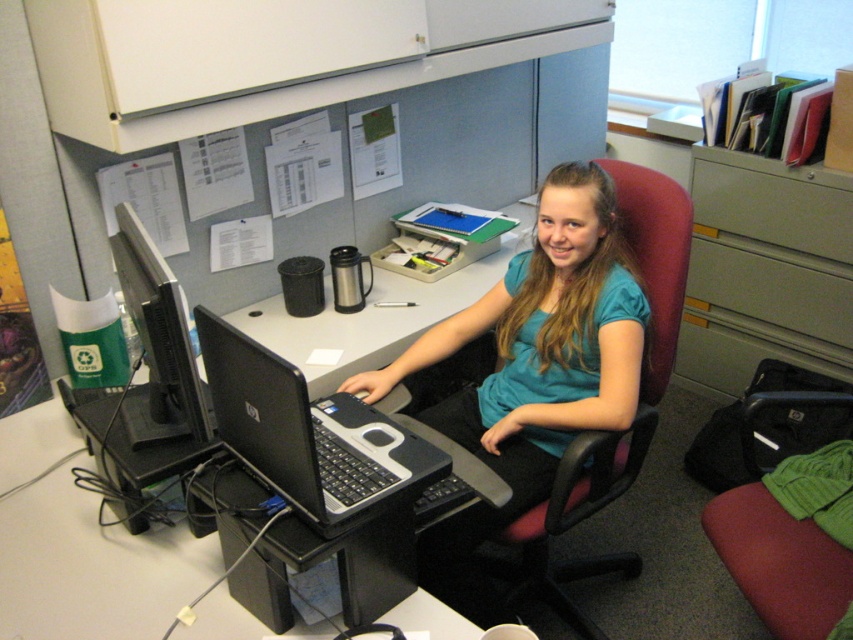
Between green matte file cabinet at right and black matte laptop at center, which one has less height?

With less height is black matte laptop at center.

Who is higher up, green matte file cabinet at right or black matte laptop at center?

green matte file cabinet at right is above.

This screenshot has width=853, height=640. What do you see at coordinates (764, 269) in the screenshot? I see `green matte file cabinet at right` at bounding box center [764, 269].

Locate an element on the screen. This screenshot has width=853, height=640. green matte file cabinet at right is located at coordinates (764, 269).

Find the location of a particular element. Image resolution: width=853 pixels, height=640 pixels. teal fabric shirt at center is located at coordinates (543, 342).

Can you confirm if green matte file cabinet at right is positioned above green knitted sweater at lower right?

Indeed, green matte file cabinet at right is positioned over green knitted sweater at lower right.

Between point (735, 228) and point (772, 396), which one is positioned in front?

Positioned in front is point (772, 396).

The image size is (853, 640). In order to click on green matte file cabinet at right in this screenshot , I will do [x=764, y=269].